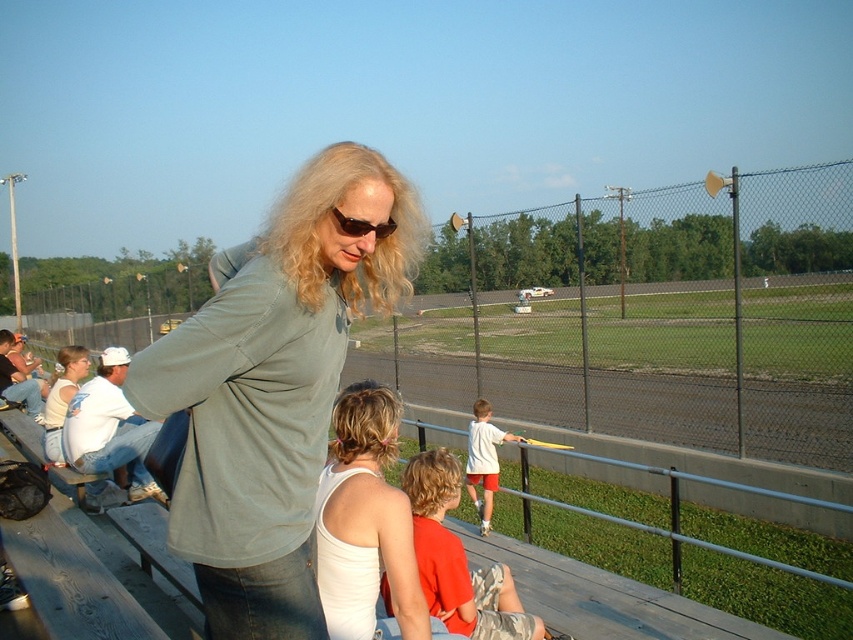
Question: Can you confirm if orange cotton shirt at center is positioned to the left of white matte shirt at center?

Choices:
 (A) no
 (B) yes

Answer: (B)

Question: Does matte green shirt at center have a larger size compared to orange cotton shirt at center?

Choices:
 (A) no
 (B) yes

Answer: (B)

Question: Which of these objects is positioned closest to the white tank top at center?

Choices:
 (A) orange cotton shirt at center
 (B) matte green shirt at center
 (C) white matte shirt at center
 (D) matte black sunglasses at center

Answer: (A)

Question: Estimate the real-world distances between objects in this image. Which object is closer to the orange cotton shirt at center?

Choices:
 (A) white matte shirt at center
 (B) matte black sunglasses at center
 (C) white tank top at center

Answer: (C)

Question: Can you confirm if matte green shirt at center is positioned above white matte shirt at center?

Choices:
 (A) no
 (B) yes

Answer: (B)

Question: Which of these objects is positioned closest to the white matte shirt at center?

Choices:
 (A) orange cotton shirt at center
 (B) white tank top at center
 (C) matte green shirt at center
 (D) matte black sunglasses at center

Answer: (A)